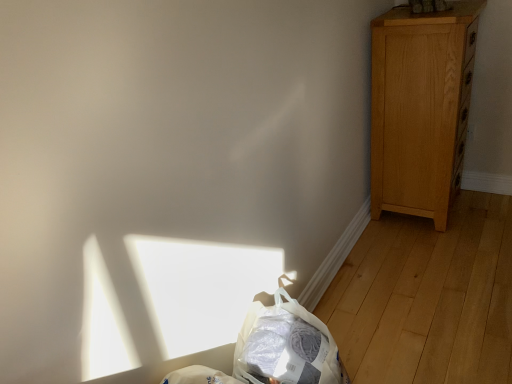
In order to face translucent plastic bag at lower center, should I rotate leftwards or rightwards?

A 5.466 degree turn to the right will do.

Locate an element on the screen. translucent plastic bag at lower center is located at coordinates (287, 346).

Measure the distance between translucent plastic bag at lower center and camera.

translucent plastic bag at lower center is 1.13 meters from camera.

Describe the element at coordinates (287, 346) in the screenshot. I see `translucent plastic bag at lower center` at that location.

You are a GUI agent. You are given a task and a screenshot of the screen. Output one action in this format:
    pyautogui.click(x=<x>, y=<y>)
    Task: Click on the light brown wood dresser at right
    The image size is (512, 384).
    Given the screenshot: What is the action you would take?
    pyautogui.click(x=420, y=108)

This screenshot has height=384, width=512. What do you see at coordinates (420, 108) in the screenshot?
I see `light brown wood dresser at right` at bounding box center [420, 108].

The height and width of the screenshot is (384, 512). Find the location of `translucent plastic bag at lower center`. translucent plastic bag at lower center is located at coordinates (287, 346).

In the scene shown: Is light brown wood dresser at right to the left of translucent plastic bag at lower center from the viewer's perspective?

Incorrect, light brown wood dresser at right is not on the left side of translucent plastic bag at lower center.

Does light brown wood dresser at right come in front of translucent plastic bag at lower center?

That is False.

Which is in front, point (387, 99) or point (337, 350)?

The point (337, 350) is in front.

From the image's perspective, relative to translucent plastic bag at lower center, is light brown wood dresser at right above or below?

Clearly, from the image's perspective, light brown wood dresser at right is above translucent plastic bag at lower center.

From a real-world perspective, which object stands above the other?

light brown wood dresser at right, from a real-world perspective.

Considering the relative sizes of light brown wood dresser at right and translucent plastic bag at lower center in the image provided, is light brown wood dresser at right wider than translucent plastic bag at lower center?

Indeed, light brown wood dresser at right has a greater width compared to translucent plastic bag at lower center.

From the picture: Considering the sizes of objects light brown wood dresser at right and translucent plastic bag at lower center in the image provided, who is taller, light brown wood dresser at right or translucent plastic bag at lower center?

With more height is light brown wood dresser at right.

Is light brown wood dresser at right smaller than translucent plastic bag at lower center?

Incorrect, light brown wood dresser at right is not smaller in size than translucent plastic bag at lower center.

Do you think light brown wood dresser at right is within translucent plastic bag at lower center, or outside of it?

light brown wood dresser at right is spatially situated outside translucent plastic bag at lower center.

Is light brown wood dresser at right next to translucent plastic bag at lower center and touching it?

No, light brown wood dresser at right is not beside translucent plastic bag at lower center.

Is light brown wood dresser at right turned away from translucent plastic bag at lower center?

No, light brown wood dresser at right is not facing the opposite direction of translucent plastic bag at lower center.

What's the angular difference between light brown wood dresser at right and translucent plastic bag at lower center's facing directions?

light brown wood dresser at right and translucent plastic bag at lower center are facing 0.283 degrees away from each other.

Find the location of a particular element. The width and height of the screenshot is (512, 384). diaper bag in front of the light brown wood dresser at right is located at coordinates (287, 346).

Is translucent plastic bag at lower center at the right side of light brown wood dresser at right?

No, translucent plastic bag at lower center is not to the right of light brown wood dresser at right.

Which object is further away from the camera, translucent plastic bag at lower center or light brown wood dresser at right?

light brown wood dresser at right is more distant.

Which point is more forward, (278, 361) or (409, 135)?

The point (278, 361) is in front.

Based on the photo, from the image's perspective, is translucent plastic bag at lower center under light brown wood dresser at right?

Yes.

From a real-world perspective, is translucent plastic bag at lower center physically above light brown wood dresser at right?

No, from a real-world perspective, translucent plastic bag at lower center is not above light brown wood dresser at right.

In terms of width, does translucent plastic bag at lower center look wider or thinner when compared to light brown wood dresser at right?

Considering their sizes, translucent plastic bag at lower center looks slimmer than light brown wood dresser at right.

Can you confirm if translucent plastic bag at lower center is taller than light brown wood dresser at right?

No.

Based on the photo, who is bigger, translucent plastic bag at lower center or light brown wood dresser at right?

light brown wood dresser at right.

Which is correct: translucent plastic bag at lower center is inside light brown wood dresser at right, or outside of it?

translucent plastic bag at lower center cannot be found inside light brown wood dresser at right.

Are translucent plastic bag at lower center and light brown wood dresser at right far apart?

Absolutely, translucent plastic bag at lower center is distant from light brown wood dresser at right.

Is light brown wood dresser at right at the back of translucent plastic bag at lower center?

No.

What's the angular difference between translucent plastic bag at lower center and light brown wood dresser at right's facing directions?

The angle between the facing direction of translucent plastic bag at lower center and the facing direction of light brown wood dresser at right is 0.283 degrees.

How far apart are translucent plastic bag at lower center and light brown wood dresser at right?

They are 3.98 feet apart.

Where is `dresser to the right of translucent plastic bag at lower center`? dresser to the right of translucent plastic bag at lower center is located at coordinates (420, 108).

Find the location of a particular element. dresser located on the right of translucent plastic bag at lower center is located at coordinates (420, 108).

Where is `diaper bag in front of the light brown wood dresser at right`? diaper bag in front of the light brown wood dresser at right is located at coordinates (287, 346).